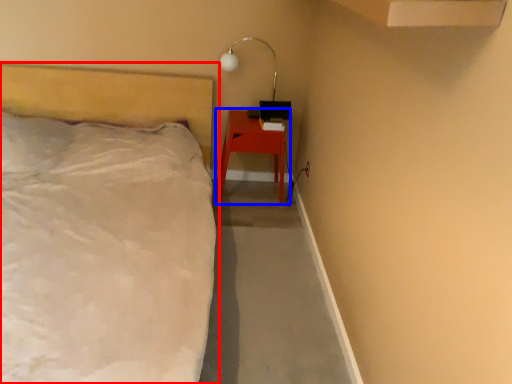
Question: Among these objects, which one is nearest to the camera, bed (highlighted by a red box) or nightstand (highlighted by a blue box)?

Choices:
 (A) bed
 (B) nightstand

Answer: (A)